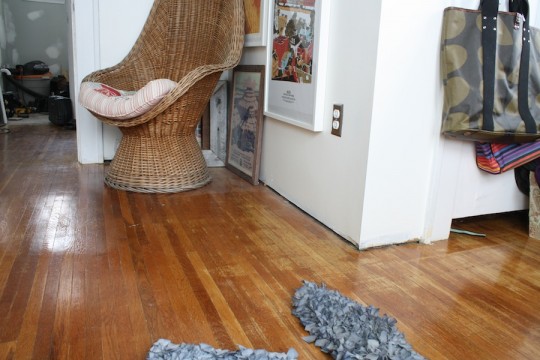
Locate an element on the screen. Image resolution: width=540 pixels, height=360 pixels. outlet is located at coordinates (341, 118).